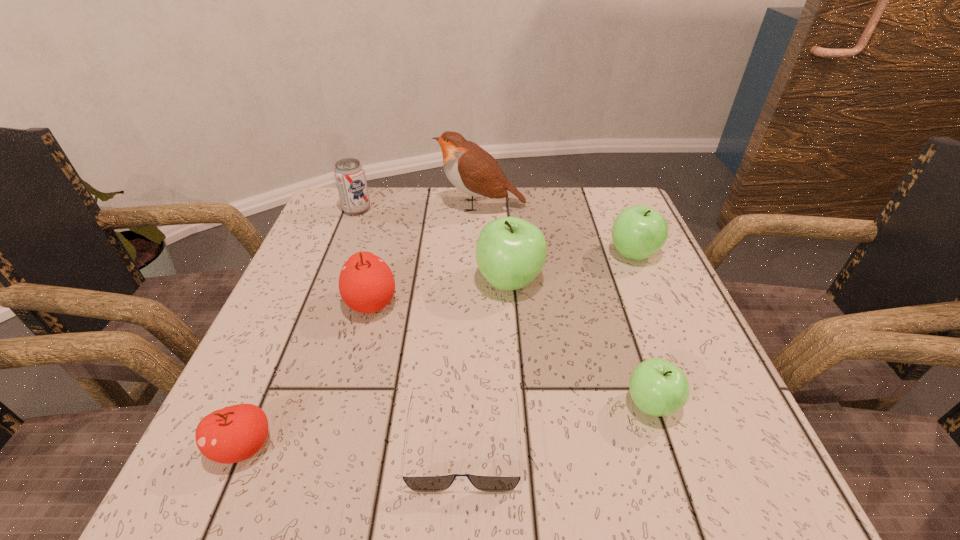
Where is `the left red apple`? the left red apple is located at coordinates (235, 433).

Locate an element on the screen. the shortest object is located at coordinates (420, 483).

Locate an element on the screen. This screenshot has width=960, height=540. free space located at the face of the brown bird is located at coordinates (390, 205).

Image resolution: width=960 pixels, height=540 pixels. I want to click on vacant region located 0.240m at the face of the brown bird, so click(344, 205).

Find the location of a particular element. Image resolution: width=960 pixels, height=540 pixels. vacant space located 0.130m at the face of the brown bird is located at coordinates (386, 205).

This screenshot has height=540, width=960. I want to click on vacant space situated 0.320m on the front of the seventh shortest object, so click(x=523, y=465).

Identify the location of vacant space located on the front of the beer can. The height and width of the screenshot is (540, 960). tap(339, 257).

Locate an element on the screen. Image resolution: width=960 pixels, height=540 pixels. free space located on the back of the second biggest green apple is located at coordinates (615, 211).

The height and width of the screenshot is (540, 960). I want to click on blank space located on the right of the right red apple, so click(x=423, y=303).

The image size is (960, 540). Identify the location of vacant position located on the back of the smallest green apple. (618, 305).